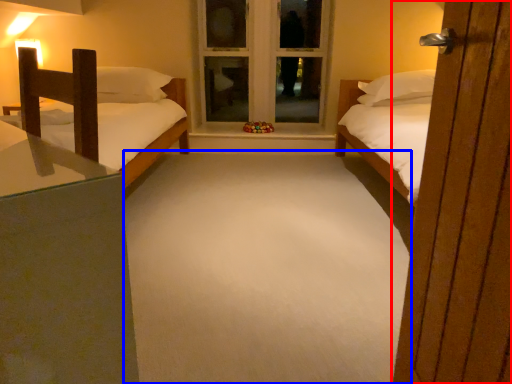
Question: Which object appears closest to the camera in this image, door (highlighted by a red box) or plain (highlighted by a blue box)?

Choices:
 (A) door
 (B) plain

Answer: (A)